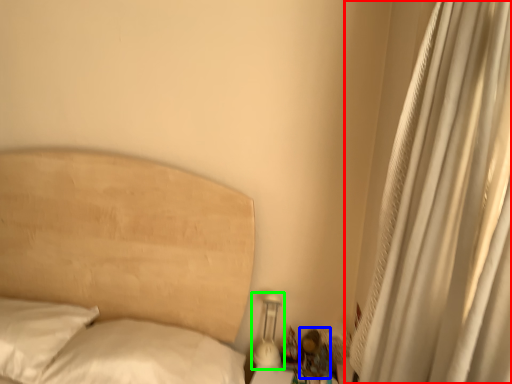
Question: Which object is positioned farthest from curtain (highlighted by a red box)? Select from miniature (highlighted by a blue box) and bedside lamp (highlighted by a green box).

Choices:
 (A) miniature
 (B) bedside lamp

Answer: (B)